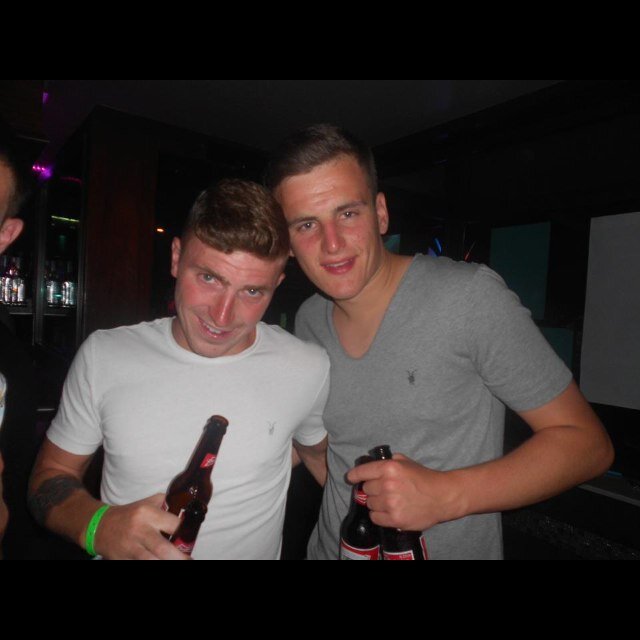
What are the coordinates of `bar` in the screenshot? It's located at (495, 205).